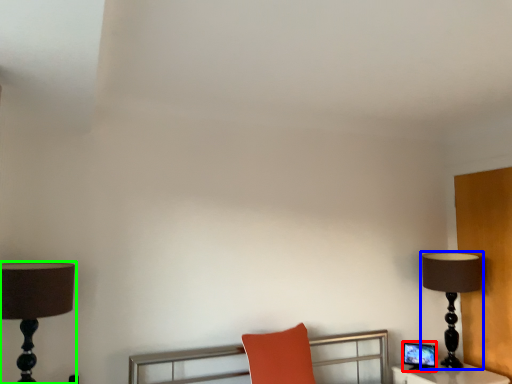
Question: Considering the real-world distances, which object is farthest from computer monitor (highlighted by a red box)? lamp (highlighted by a blue box) or lamp (highlighted by a green box)?

Choices:
 (A) lamp
 (B) lamp

Answer: (B)